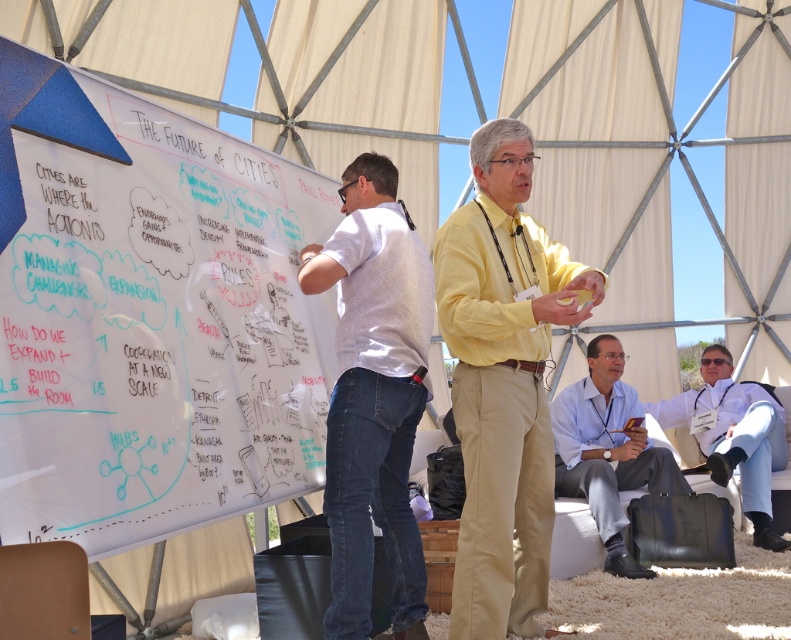
Measure the distance between white shirt at right and white fabric shirt at right.

white shirt at right and white fabric shirt at right are 35.25 inches apart from each other.

Does point (562, 465) come behind point (721, 433)?

No, (562, 465) is in front of (721, 433).

Who is more forward, (619, 477) or (771, 397)?

Point (619, 477)

Where is `white shirt at right`? white shirt at right is located at coordinates (607, 451).

Can you confirm if white cotton shirt at left is positioned above white shirt at right?

Correct, white cotton shirt at left is located above white shirt at right.

Is white cotton shirt at left thinner than white shirt at right?

Yes, white cotton shirt at left is thinner than white shirt at right.

Is point (339, 541) closer to viewer compared to point (558, 460)?

Yes, it is in front of point (558, 460).

Where is `white cotton shirt at left`? Image resolution: width=791 pixels, height=640 pixels. white cotton shirt at left is located at coordinates (373, 396).

Which is more to the right, whiteboard at left or white shirt at right?

white shirt at right is more to the right.

Can you confirm if whiteboard at left is thinner than white shirt at right?

Correct, whiteboard at left's width is less than white shirt at right's.

Between point (316, 448) and point (593, 353), which one is positioned behind?

The point (593, 353) is more distant.

The image size is (791, 640). Find the location of `whiteboard at left`. whiteboard at left is located at coordinates (157, 332).